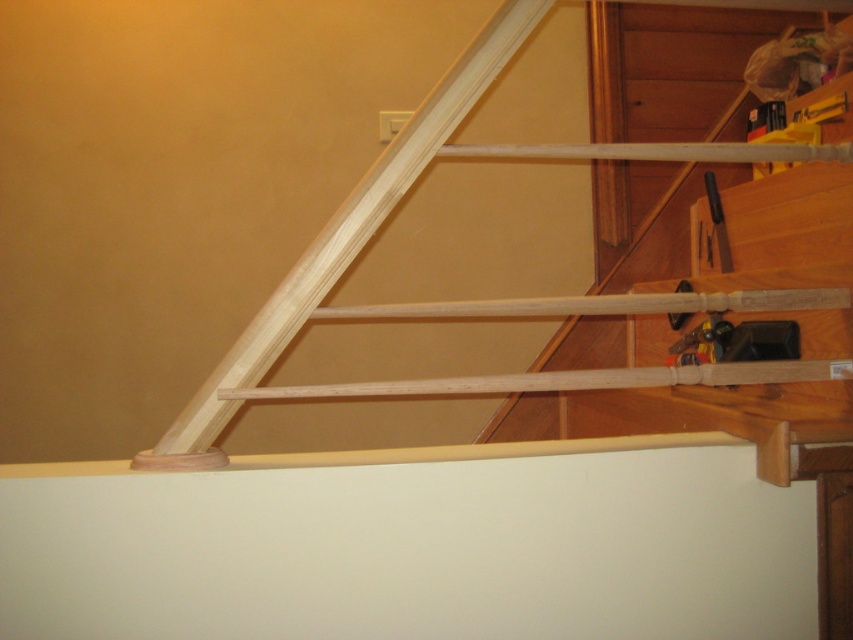
Question: Which point appears farthest from the camera in this image?

Choices:
 (A) (709, 195)
 (B) (675, 323)
 (C) (502, 65)

Answer: (A)

Question: Is natural wood handrail at upper right to the left of black plastic screwdriver at upper right from the viewer's perspective?

Choices:
 (A) no
 (B) yes

Answer: (B)

Question: Which point is closer to the camera?

Choices:
 (A) (706, 184)
 (B) (264, 321)
 (C) (676, 289)
 (D) (602, 188)

Answer: (B)

Question: Which point is farther to the camera?

Choices:
 (A) black plastic screwdriver at upper right
 (B) natural wood handrail at upper right
 (C) natural wood ladder at upper center

Answer: (B)

Question: From the image, what is the correct spatial relationship of natural wood handrail at upper right in relation to metallic silver tool at upper right?

Choices:
 (A) above
 (B) below

Answer: (A)

Question: In this image, where is natural wood ladder at upper center located relative to metallic silver tool at upper right?

Choices:
 (A) left
 (B) right

Answer: (A)